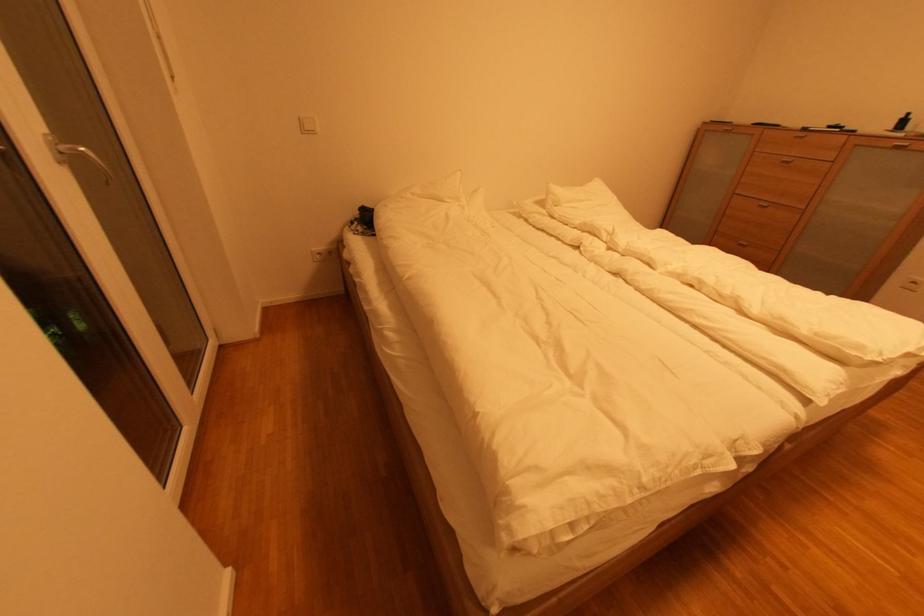
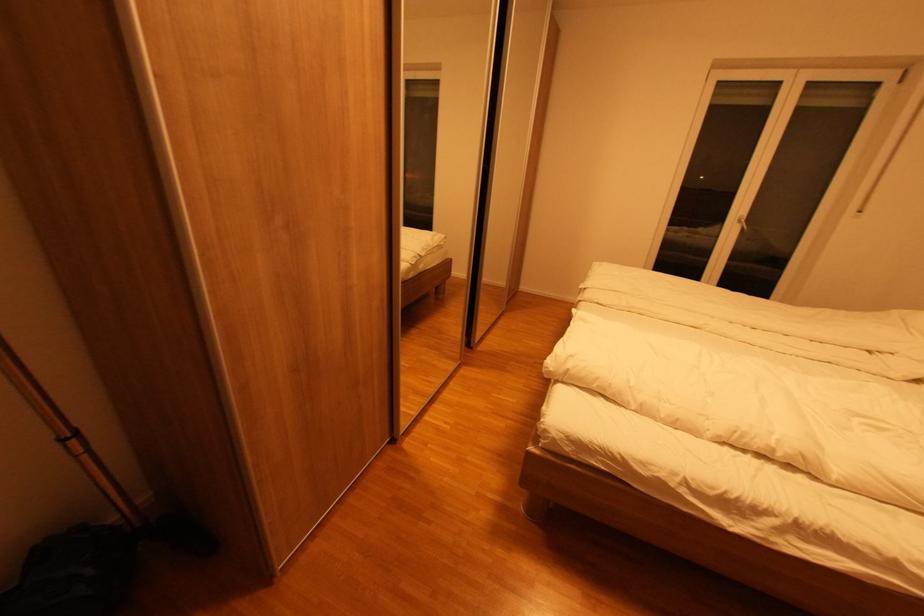
Locate, in the second image, the point that corresponds to point (43, 140) in the first image.

(744, 216)